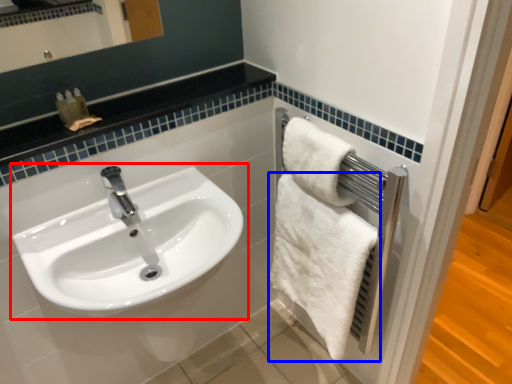
Question: Which point is closer to the camera, sink (highlighted by a red box) or towel (highlighted by a blue box)?

Choices:
 (A) sink
 (B) towel

Answer: (A)